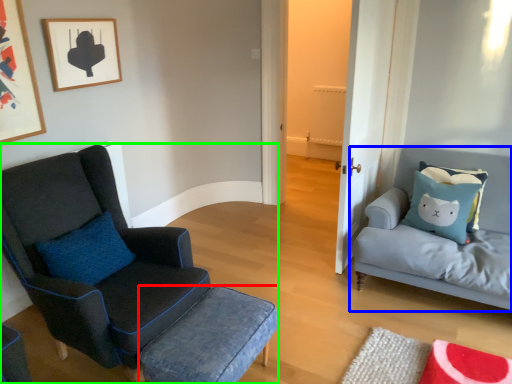
Question: Which object is positioned farthest from stool (highlighted by a red box)? Select from studio couch (highlighted by a blue box) and chair (highlighted by a green box).

Choices:
 (A) studio couch
 (B) chair

Answer: (A)